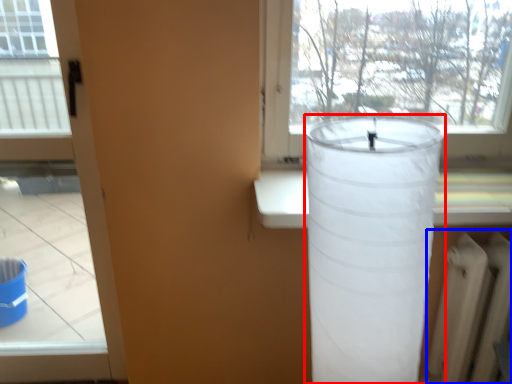
Question: Which point is closer to the camera, lamp (highlighted by a red box) or radiator (highlighted by a blue box)?

Choices:
 (A) lamp
 (B) radiator

Answer: (A)